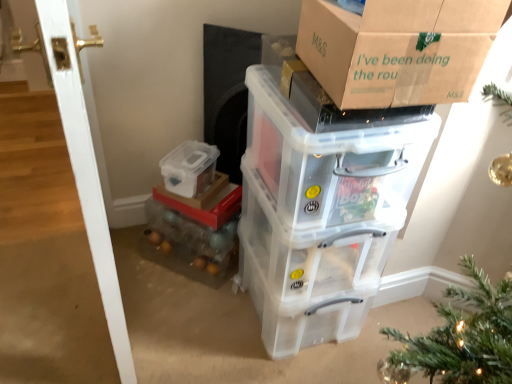
Find the location of `transparent plastic storage box at lower center, marked as the second storage box in a top-to-bottom arrangement`. transparent plastic storage box at lower center, marked as the second storage box in a top-to-bottom arrangement is located at coordinates (189, 168).

This screenshot has height=384, width=512. Describe the element at coordinates (205, 202) in the screenshot. I see `translucent plastic storage box at lower center, the third storage box viewed from the top` at that location.

At what (x,y) coordinates should I click in order to perform the action: click on brown cardboard box at upper center. Please return your answer as a coordinate pair (x, y). This screenshot has width=512, height=384. Looking at the image, I should click on (398, 49).

The height and width of the screenshot is (384, 512). What do you see at coordinates (305, 315) in the screenshot?
I see `transparent plastic storage box at center, which is the 4th storage box in top-to-bottom order` at bounding box center [305, 315].

How much space does transparent plastic storage box at upper right, acting as the first storage box starting from the top, occupy horizontally?

transparent plastic storage box at upper right, acting as the first storage box starting from the top, is 60.72 centimeters wide.

How much space does transparent plastic storage box at upper right, marked as the fourth storage box in a bottom-to-top arrangement, occupy vertically?

It is 12.57 inches.

This screenshot has height=384, width=512. In order to click on transparent plastic storage box at lower center, which ranks as the 3th storage box in bottom-to-top order in this screenshot , I will do `click(189, 168)`.

Does brown cardboard box at upper center have a lesser width compared to clear plastic microwave at center?

In fact, brown cardboard box at upper center might be wider than clear plastic microwave at center.

You are a GUI agent. You are given a task and a screenshot of the screen. Output one action in this format:
    pyautogui.click(x=<x>, y=<y>)
    Task: Click on the box that is above the clear plastic microwave at center (from a real-world perspective)
    
    Given the screenshot: What is the action you would take?
    pyautogui.click(x=398, y=49)

Is brown cardboard box at upper center turned away from clear plastic microwave at center?

No.

What's the angular difference between brown cardboard box at upper center and clear plastic microwave at center's facing directions?

The angle between the facing direction of brown cardboard box at upper center and the facing direction of clear plastic microwave at center is 34.3 degrees.

Is clear plastic microwave at center oriented away from brown cardboard box at upper center?

That's not correct — clear plastic microwave at center is not looking away from brown cardboard box at upper center.

Is clear plastic microwave at center not within brown cardboard box at upper center?

Absolutely, clear plastic microwave at center is external to brown cardboard box at upper center.

Does clear plastic microwave at center appear on the left side of brown cardboard box at upper center?

Yes, clear plastic microwave at center is to the left of brown cardboard box at upper center.

Measure the distance from clear plastic microwave at center to brown cardboard box at upper center.

29.24 inches.

In terms of height, does translucent plastic storage box at lower center, the second storage box ordered from the bottom, look taller or shorter compared to transparent plastic storage box at lower center, marked as the second storage box in a top-to-bottom arrangement?

translucent plastic storage box at lower center, the second storage box ordered from the bottom, is shorter than transparent plastic storage box at lower center, marked as the second storage box in a top-to-bottom arrangement.

How different are the orientations of translucent plastic storage box at lower center, the third storage box viewed from the top, and transparent plastic storage box at lower center, which ranks as the 3th storage box in bottom-to-top order, in degrees?

They differ by 3.8 degrees in their facing directions.

From the picture: Considering their positions, is translucent plastic storage box at lower center, the third storage box viewed from the top, located in front of or behind transparent plastic storage box at lower center, marked as the second storage box in a top-to-bottom arrangement?

Clearly, translucent plastic storage box at lower center, the third storage box viewed from the top, is behind transparent plastic storage box at lower center, marked as the second storage box in a top-to-bottom arrangement.

Between translucent plastic storage box at lower center, the third storage box viewed from the top, and transparent plastic storage box at lower center, which ranks as the 3th storage box in bottom-to-top order, which one appears on the left side from the viewer's perspective?

Positioned to the left is transparent plastic storage box at lower center, which ranks as the 3th storage box in bottom-to-top order.

In the scene shown: Is white glossy door at left situated inside transparent plastic storage box at center, which is counted as the first storage box, starting from the bottom, or outside?

white glossy door at left exists outside the volume of transparent plastic storage box at center, which is counted as the first storage box, starting from the bottom.

In terms of height, does white glossy door at left look taller or shorter compared to transparent plastic storage box at center, which is the 4th storage box in top-to-bottom order?

white glossy door at left is taller than transparent plastic storage box at center, which is the 4th storage box in top-to-bottom order.

Is white glossy door at left placed right next to transparent plastic storage box at center, which is counted as the first storage box, starting from the bottom?

No, white glossy door at left is not with transparent plastic storage box at center, which is counted as the first storage box, starting from the bottom.

Could you tell me if white glossy door at left is facing transparent plastic storage box at center, which is counted as the first storage box, starting from the bottom?

No, white glossy door at left does not turn towards transparent plastic storage box at center, which is counted as the first storage box, starting from the bottom.

Is transparent plastic storage box at lower center, which ranks as the 3th storage box in bottom-to-top order, taller or shorter than translucent plastic storage box at lower center, the second storage box ordered from the bottom?

In the image, transparent plastic storage box at lower center, which ranks as the 3th storage box in bottom-to-top order, appears to be taller than translucent plastic storage box at lower center, the second storage box ordered from the bottom.

Is transparent plastic storage box at lower center, marked as the second storage box in a top-to-bottom arrangement, facing towards translucent plastic storage box at lower center, the third storage box viewed from the top?

No, transparent plastic storage box at lower center, marked as the second storage box in a top-to-bottom arrangement, is not aimed at translucent plastic storage box at lower center, the third storage box viewed from the top.

Between transparent plastic storage box at lower center, marked as the second storage box in a top-to-bottom arrangement, and translucent plastic storage box at lower center, the second storage box ordered from the bottom, which one appears on the left side from the viewer's perspective?

Positioned to the left is transparent plastic storage box at lower center, marked as the second storage box in a top-to-bottom arrangement.

From the image's perspective, is transparent plastic storage box at lower center, which ranks as the 3th storage box in bottom-to-top order, under translucent plastic storage box at lower center, the third storage box viewed from the top?

No, from the image's perspective, transparent plastic storage box at lower center, which ranks as the 3th storage box in bottom-to-top order, is not beneath translucent plastic storage box at lower center, the third storage box viewed from the top.

Considering the relative sizes of brown cardboard box at upper center and transparent plastic storage box at center, which is the 4th storage box in top-to-bottom order, in the image provided, is brown cardboard box at upper center bigger than transparent plastic storage box at center, which is the 4th storage box in top-to-bottom order,?

No.

Would you say brown cardboard box at upper center is a long distance from transparent plastic storage box at center, which is the 4th storage box in top-to-bottom order?

No, brown cardboard box at upper center is not far from transparent plastic storage box at center, which is the 4th storage box in top-to-bottom order.

From the picture: From the image's perspective, which is below, brown cardboard box at upper center or transparent plastic storage box at center, which is the 4th storage box in top-to-bottom order?

transparent plastic storage box at center, which is the 4th storage box in top-to-bottom order, appears lower in the image.

Between brown cardboard box at upper center and transparent plastic storage box at center, which is the 4th storage box in top-to-bottom order, which one is positioned behind?

transparent plastic storage box at center, which is the 4th storage box in top-to-bottom order, is behind.

From a real-world perspective, does clear plastic microwave at center sit lower than transparent plastic storage box at center, which is counted as the first storage box, starting from the bottom?

No.

Is the position of clear plastic microwave at center less distant than that of transparent plastic storage box at center, which is counted as the first storage box, starting from the bottom?

No, it is behind transparent plastic storage box at center, which is counted as the first storage box, starting from the bottom.

Is clear plastic microwave at center smaller than transparent plastic storage box at center, which is the 4th storage box in top-to-bottom order?

Yes.

Considering the relative sizes of clear plastic microwave at center and transparent plastic storage box at center, which is the 4th storage box in top-to-bottom order, in the image provided, is clear plastic microwave at center taller than transparent plastic storage box at center, which is the 4th storage box in top-to-bottom order,?

Indeed, clear plastic microwave at center has a greater height compared to transparent plastic storage box at center, which is the 4th storage box in top-to-bottom order.

I want to click on appliance on the left of brown cardboard box at upper center, so click(x=227, y=92).

Identify the location of appliance that is under the brown cardboard box at upper center (from a real-world perspective). (227, 92).

Estimate the real-world distances between objects in this image. Which object is closer to transparent plastic storage box at upper right, marked as the fourth storage box in a bottom-to-top arrangement, brown cardboard box at upper center or transparent plastic storage box at center, which is counted as the first storage box, starting from the bottom?

transparent plastic storage box at center, which is counted as the first storage box, starting from the bottom.

When comparing their distances from transparent plastic storage box at center, which is the 4th storage box in top-to-bottom order, does translucent plastic storage box at lower center, the third storage box viewed from the top, or transparent plastic storage box at upper right, acting as the first storage box starting from the top, seem closer?

transparent plastic storage box at upper right, acting as the first storage box starting from the top.

Considering their positions, is transparent plastic storage box at lower center, which ranks as the 3th storage box in bottom-to-top order, positioned further to white glossy door at left than transparent plastic storage box at center, which is the 4th storage box in top-to-bottom order?

transparent plastic storage box at center, which is the 4th storage box in top-to-bottom order, is further to white glossy door at left.

Estimate the real-world distances between objects in this image. Which object is further from clear plastic microwave at center, white glossy door at left or translucent plastic storage box at lower center, the second storage box ordered from the bottom?

white glossy door at left.

Estimate the real-world distances between objects in this image. Which object is closer to white glossy door at left, brown cardboard box at upper center or transparent plastic storage box at center, which is the 4th storage box in top-to-bottom order?

transparent plastic storage box at center, which is the 4th storage box in top-to-bottom order, lies closer to white glossy door at left than the other object.

From the picture: Looking at the image, which one is located closer to translucent plastic storage box at lower center, the third storage box viewed from the top, transparent plastic storage box at lower center, which ranks as the 3th storage box in bottom-to-top order, or clear plastic microwave at center?

transparent plastic storage box at lower center, which ranks as the 3th storage box in bottom-to-top order, is closer to translucent plastic storage box at lower center, the third storage box viewed from the top.

Estimate the real-world distances between objects in this image. Which object is further from transparent plastic storage box at center, which is the 4th storage box in top-to-bottom order, white glossy door at left or transparent plastic storage box at lower center, marked as the second storage box in a top-to-bottom arrangement?

white glossy door at left is positioned further to the anchor transparent plastic storage box at center, which is the 4th storage box in top-to-bottom order.

Looking at the image, which one is located closer to translucent plastic storage box at lower center, the third storage box viewed from the top, transparent plastic storage box at upper right, acting as the first storage box starting from the top, or clear plastic microwave at center?

clear plastic microwave at center is positioned closer to the anchor translucent plastic storage box at lower center, the third storage box viewed from the top.

The height and width of the screenshot is (384, 512). Identify the location of appliance between transparent plastic storage box at upper right, marked as the fourth storage box in a bottom-to-top arrangement, and translucent plastic storage box at lower center, the second storage box ordered from the bottom, from front to back. (227, 92).

This screenshot has height=384, width=512. Identify the location of appliance between brown cardboard box at upper center and transparent plastic storage box at lower center, which ranks as the 3th storage box in bottom-to-top order, from front to back. (227, 92).

Locate an element on the screen. Image resolution: width=512 pixels, height=384 pixels. box between white glossy door at left and translucent plastic storage box at lower center, the third storage box viewed from the top, along the z-axis is located at coordinates (398, 49).

Locate an element on the screen. This screenshot has width=512, height=384. appliance between white glossy door at left and transparent plastic storage box at lower center, which ranks as the 3th storage box in bottom-to-top order, along the z-axis is located at coordinates (227, 92).